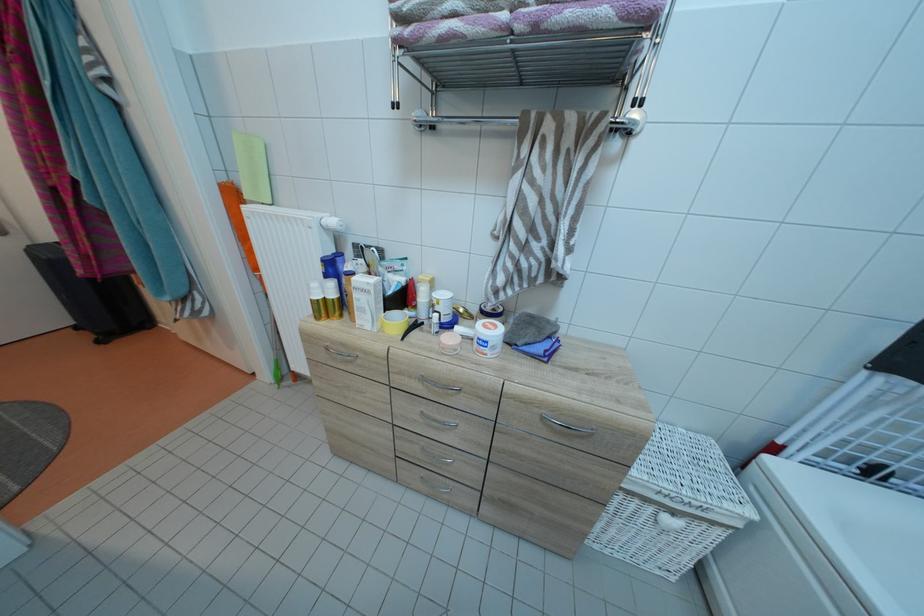
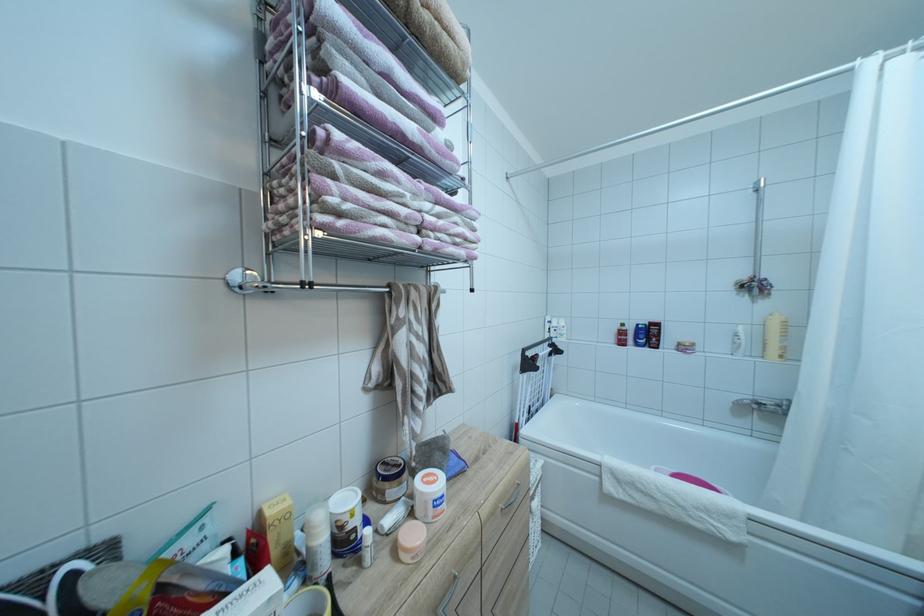
Find the pixel in the second image that matches (496,334) in the first image.

(442, 487)